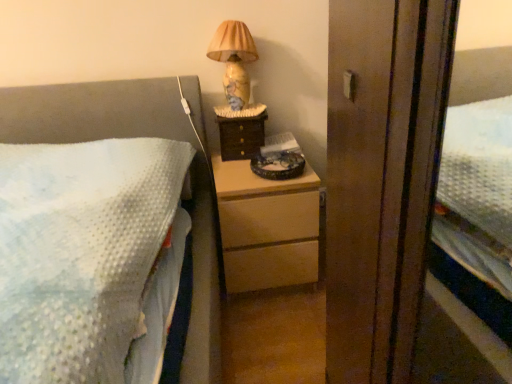
What are the coordinates of `light wood chest of drawers at center` in the screenshot? It's located at (267, 227).

From the image's perspective, is wooden drawer at center located beneath light wood chest of drawers at center?

Actually, wooden drawer at center appears above light wood chest of drawers at center in the image.

From a real-world perspective, is wooden drawer at center located beneath light wood chest of drawers at center?

No.

Which is correct: wooden drawer at center is inside light wood chest of drawers at center, or outside of it?

The correct answer is: outside.

Can you confirm if wooden drawer at center is shorter than light wood chest of drawers at center?

Correct, wooden drawer at center is not as tall as light wood chest of drawers at center.

From the image's perspective, which object appears higher, light wood chest of drawers at center or marble-patterned lampshade at upper right?

marble-patterned lampshade at upper right appears higher in the image.

Is light wood chest of drawers at center further to the viewer compared to marble-patterned lampshade at upper right?

No, the depth of light wood chest of drawers at center is less than that of marble-patterned lampshade at upper right.

From a real-world perspective, between light wood chest of drawers at center and marble-patterned lampshade at upper right, who is vertically lower?

light wood chest of drawers at center.

Is marble-patterned lampshade at upper right thinner than light wood chest of drawers at center?

Correct, the width of marble-patterned lampshade at upper right is less than that of light wood chest of drawers at center.

From the image's perspective, is marble-patterned lampshade at upper right below light wood chest of drawers at center?

Actually, marble-patterned lampshade at upper right appears above light wood chest of drawers at center in the image.

How far apart are marble-patterned lampshade at upper right and light wood chest of drawers at center?

20.49 inches.

Are marble-patterned lampshade at upper right and light wood chest of drawers at center far apart?

No, there isn't a large distance between marble-patterned lampshade at upper right and light wood chest of drawers at center.

Between point (240, 23) and point (232, 154), which one is positioned behind?

The point (232, 154) is behind.

Considering the sizes of objects marble-patterned lampshade at upper right and wooden drawer at center in the image provided, who is shorter, marble-patterned lampshade at upper right or wooden drawer at center?

wooden drawer at center is shorter.

Can you tell me how much marble-patterned lampshade at upper right and wooden drawer at center differ in facing direction?

The angular difference between marble-patterned lampshade at upper right and wooden drawer at center is 0.000356 degrees.

From the image's perspective, is wooden drawer at center below marble-patterned lampshade at upper right?

Indeed, from the image's perspective, wooden drawer at center is shown beneath marble-patterned lampshade at upper right.

At what (x,y) coordinates should I click in order to perform the action: click on nightstand below the marble-patterned lampshade at upper right (from the image's perspective). Please return your answer as a coordinate pair (x, y). This screenshot has width=512, height=384. Looking at the image, I should click on (241, 131).

Would you say wooden drawer at center is outside marble-patterned lampshade at upper right?

wooden drawer at center lies outside marble-patterned lampshade at upper right's area.

Which point is more distant from viewer, (307, 238) or (225, 140)?

The point (225, 140) is farther from the camera.

Between light wood chest of drawers at center and wooden drawer at center, which one has less height?

Standing shorter between the two is wooden drawer at center.

Is light wood chest of drawers at center located outside wooden drawer at center?

Yes.

Looking at this image, measure the distance from light wood chest of drawers at center to wooden drawer at center.

light wood chest of drawers at center and wooden drawer at center are 11.23 inches apart from each other.

Where is `nightstand behind the light wood chest of drawers at center`? nightstand behind the light wood chest of drawers at center is located at coordinates (241, 131).

At what (x,y) coordinates should I click in order to perform the action: click on the chest of drawers below the marble-patterned lampshade at upper right (from the image's perspective). Please return your answer as a coordinate pair (x, y). Looking at the image, I should click on [x=267, y=227].

When comparing their distances from marble-patterned lampshade at upper right, does wooden drawer at center or light wood chest of drawers at center seem further?

Based on the image, light wood chest of drawers at center appears to be further to marble-patterned lampshade at upper right.

From the image, which object appears to be nearer to wooden drawer at center, light wood chest of drawers at center or marble-patterned lampshade at upper right?

Among the two, marble-patterned lampshade at upper right is located nearer to wooden drawer at center.

From the image, which object appears to be nearer to light wood chest of drawers at center, marble-patterned lampshade at upper right or wooden drawer at center?

wooden drawer at center.

Which object lies nearer to the anchor point wooden drawer at center, marble-patterned lampshade at upper right or light wood chest of drawers at center?

marble-patterned lampshade at upper right is closer to wooden drawer at center.

Estimate the real-world distances between objects in this image. Which object is closer to light wood chest of drawers at center, wooden drawer at center or marble-patterned lampshade at upper right?

wooden drawer at center.

Based on their spatial positions, is light wood chest of drawers at center or wooden drawer at center closer to marble-patterned lampshade at upper right?

Among the two, wooden drawer at center is located nearer to marble-patterned lampshade at upper right.

The image size is (512, 384). What are the coordinates of `nightstand between marble-patterned lampshade at upper right and light wood chest of drawers at center from top to bottom` in the screenshot? It's located at (241, 131).